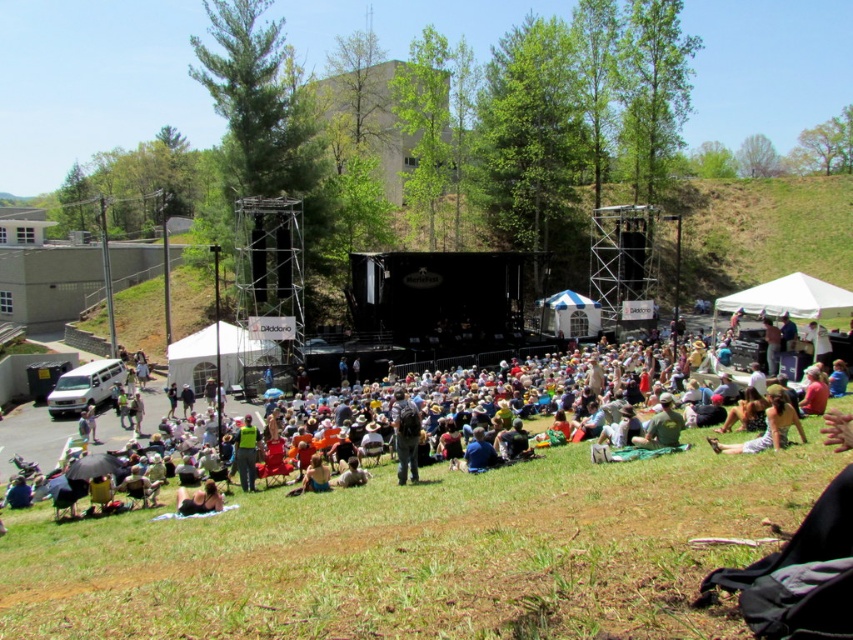
You are at the outdoor concert and want to take a photo of the blonde hair at lower center without the green fabric umbrella at center blocking the view. Which direction should you move to achieve this?

Move to the left side of the blonde hair at lower center to avoid the green fabric umbrella at center, as the umbrella is on the right side of the blonde hair at lower center.

You are a photographer at the concert and want to take a photo of the blonde hair at lower center without the green fabric blanket at center blocking the view. Can you adjust your position to achieve this?

The green fabric blanket at center is much taller than blonde hair at lower center, so adjusting your position to shoot from a lower angle or moving closer might help avoid the blanket blocking the view.